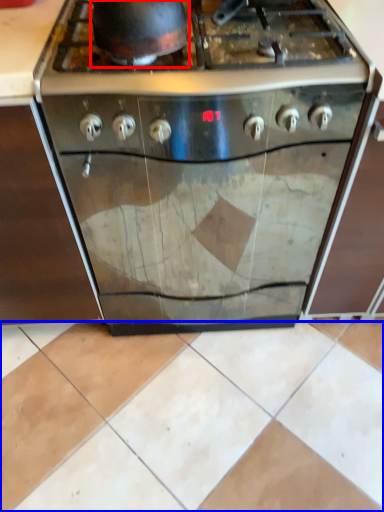
Question: Which point is further to the camera, wok (highlighted by a red box) or ceramic tile (highlighted by a blue box)?

Choices:
 (A) wok
 (B) ceramic tile

Answer: (B)